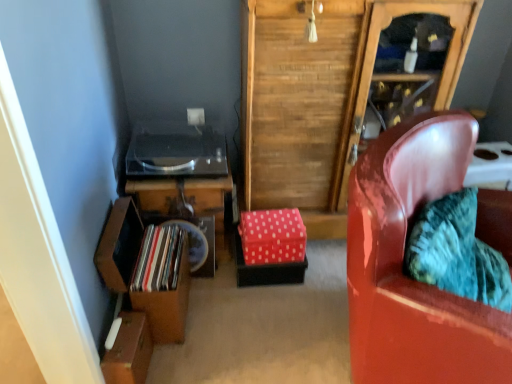
Question: From the image's perspective, is brown cardboard box at lower left, the 2th box when ordered from right to left, located above or below glossy leather chair at right?

Choices:
 (A) below
 (B) above

Answer: (A)

Question: In the image, is brown cardboard box at lower left, marked as the 1th box in a left-to-right arrangement, positioned in front of or behind glossy leather chair at right?

Choices:
 (A) behind
 (B) front

Answer: (A)

Question: Which object is positioned closest to the red polka dot fabric box at center, which ranks as the first box in top-to-bottom order?

Choices:
 (A) wooden shelf at lower left
 (B) brown cardboard box at lower left, positioned as the 2th box in top-to-bottom order
 (C) shiny metallic record at left
 (D) wooden cabinet at center
 (E) wooden record player at lower left

Answer: (E)

Question: Estimate the real-world distances between objects in this image. Which object is farther from the wooden shelf at lower left?

Choices:
 (A) glossy leather chair at right
 (B) wooden cabinet at center
 (C) brown cardboard box at lower left, which is the first box in front-to-back order
 (D) shiny metallic record at left
 (E) wooden record player at lower left

Answer: (A)